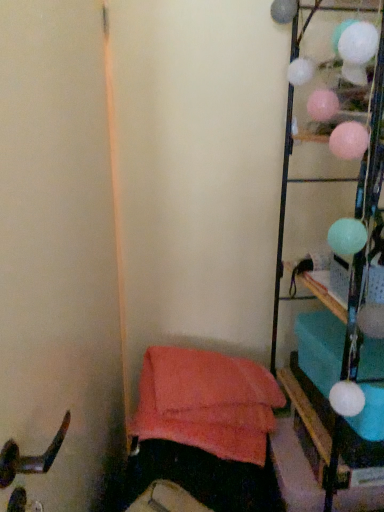
Question: From a real-world perspective, does soft coral fabric bean bag chair at lower left sit lower than metallic wire rack at right?

Choices:
 (A) no
 (B) yes

Answer: (B)

Question: Is soft coral fabric bean bag chair at lower left to the left of metallic wire rack at right from the viewer's perspective?

Choices:
 (A) yes
 (B) no

Answer: (A)

Question: Is soft coral fabric bean bag chair at lower left to the right of metallic wire rack at right from the viewer's perspective?

Choices:
 (A) no
 (B) yes

Answer: (A)

Question: Does soft coral fabric bean bag chair at lower left lie in front of metallic wire rack at right?

Choices:
 (A) yes
 (B) no

Answer: (B)

Question: Is soft coral fabric bean bag chair at lower left smaller than metallic wire rack at right?

Choices:
 (A) yes
 (B) no

Answer: (A)

Question: From a real-world perspective, is soft coral fabric bean bag chair at lower left physically above metallic wire rack at right?

Choices:
 (A) yes
 (B) no

Answer: (B)

Question: Is metallic wire rack at right far from soft coral fabric bean bag chair at lower left?

Choices:
 (A) no
 (B) yes

Answer: (A)

Question: Can soft coral fabric bean bag chair at lower left be found inside metallic wire rack at right?

Choices:
 (A) yes
 (B) no

Answer: (B)

Question: From a real-world perspective, is metallic wire rack at right over soft coral fabric bean bag chair at lower left?

Choices:
 (A) yes
 (B) no

Answer: (A)

Question: Can you confirm if metallic wire rack at right is bigger than soft coral fabric bean bag chair at lower left?

Choices:
 (A) no
 (B) yes

Answer: (B)

Question: Does metallic wire rack at right have a greater width compared to soft coral fabric bean bag chair at lower left?

Choices:
 (A) yes
 (B) no

Answer: (A)

Question: Considering the relative sizes of metallic wire rack at right and soft coral fabric bean bag chair at lower left in the image provided, is metallic wire rack at right taller than soft coral fabric bean bag chair at lower left?

Choices:
 (A) no
 (B) yes

Answer: (B)

Question: From their relative heights in the image, would you say soft coral fabric bean bag chair at lower left is taller or shorter than metallic wire rack at right?

Choices:
 (A) short
 (B) tall

Answer: (A)